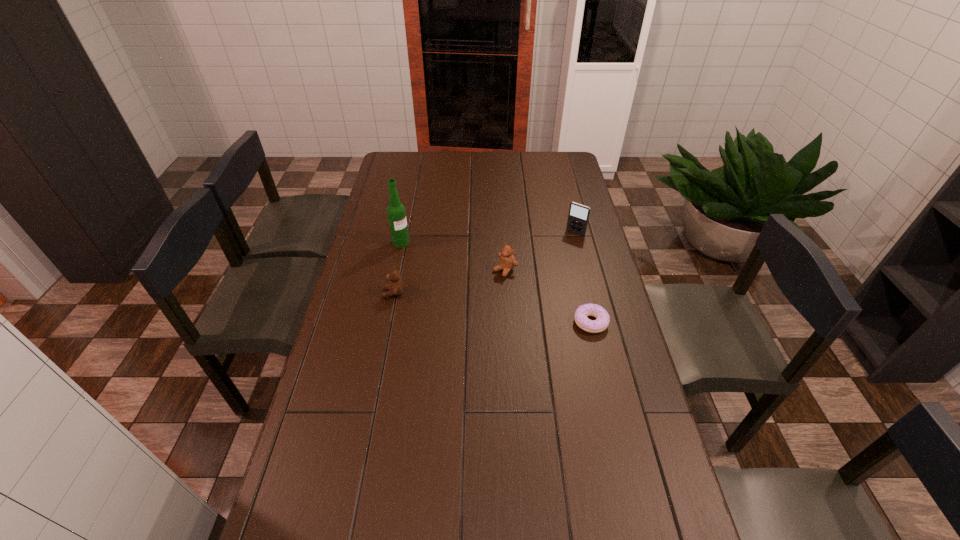
Identify which object is the second nearest to the second nearest object. Please provide its 2D coordinates. Your answer should be formatted as a tuple, i.e. [(x, y)], where the tuple contains the x and y coordinates of a point satisfying the conditions above.

[(507, 262)]

This screenshot has height=540, width=960. Find the location of `object that is the second nearest to the doughnut`. object that is the second nearest to the doughnut is located at coordinates (578, 217).